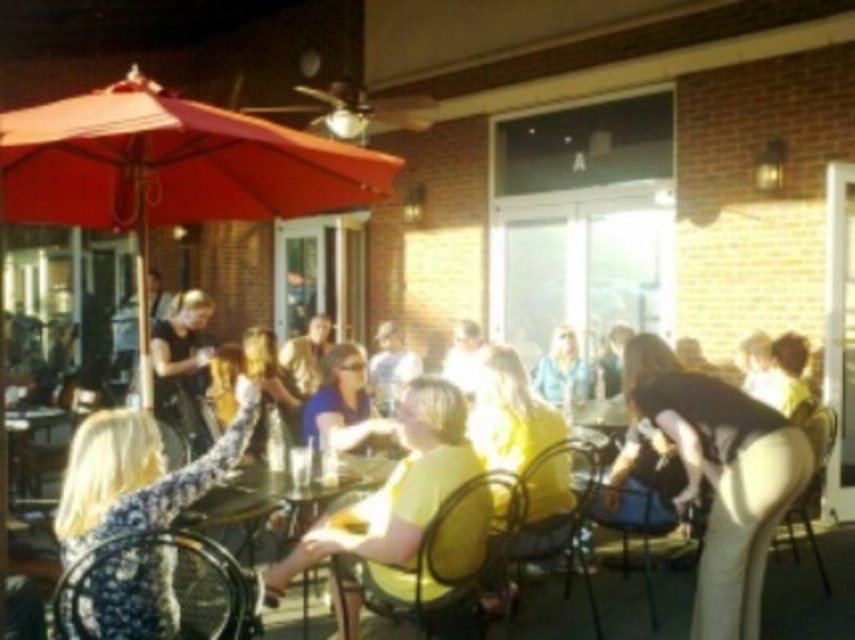
Question: Is metallic yellow chair at center closer to camera compared to light blue shirt at center?

Choices:
 (A) yes
 (B) no

Answer: (A)

Question: Is floral fabric dress at left positioned in front of floral fabric chair at lower left?

Choices:
 (A) yes
 (B) no

Answer: (B)

Question: Which object is closer to the camera taking this photo?

Choices:
 (A) clear glass table at center
 (B) black matte shirt at lower right
 (C) metallic mesh chair at center
 (D) floral fabric chair at lower left

Answer: (D)

Question: Considering the relative positions of metallic yellow chair at center and metallic silver chair at lower right in the image provided, where is metallic yellow chair at center located with respect to metallic silver chair at lower right?

Choices:
 (A) right
 (B) left

Answer: (B)

Question: Among these objects, which one is nearest to the camera?

Choices:
 (A) metallic silver chair at lower right
 (B) floral fabric chair at lower left
 (C) metallic yellow chair at center
 (D) black matte shirt at lower right

Answer: (B)

Question: Which object is the closest to the light blue shirt at center?

Choices:
 (A) metallic silver chair at lower right
 (B) yellow matte shirt at center

Answer: (A)